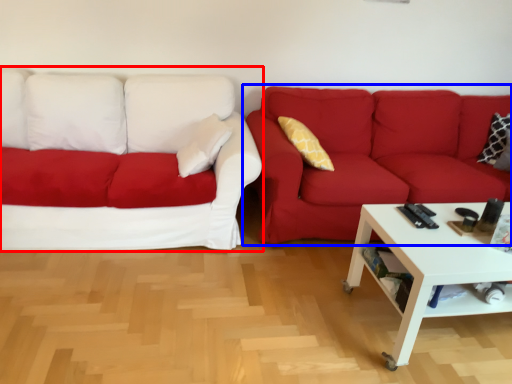
Question: Which object appears farthest to the camera in this image, studio couch (highlighted by a red box) or studio couch (highlighted by a blue box)?

Choices:
 (A) studio couch
 (B) studio couch

Answer: (B)